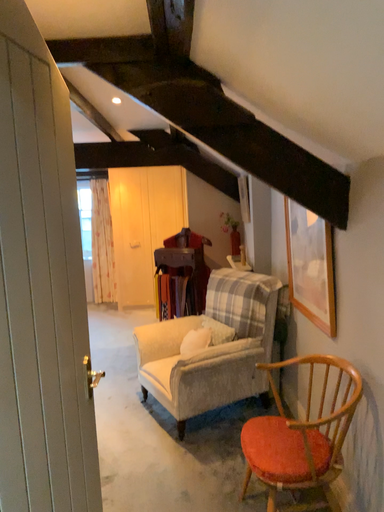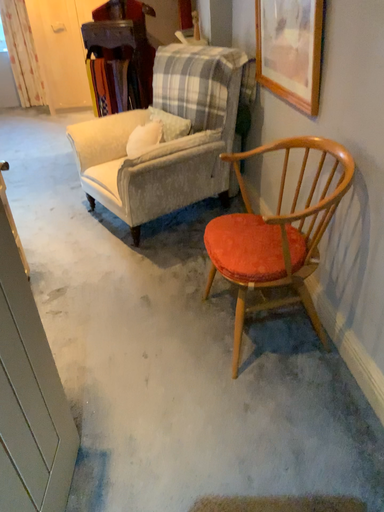
Question: Which way did the camera rotate in the video?

Choices:
 (A) rotated left
 (B) rotated right

Answer: (B)